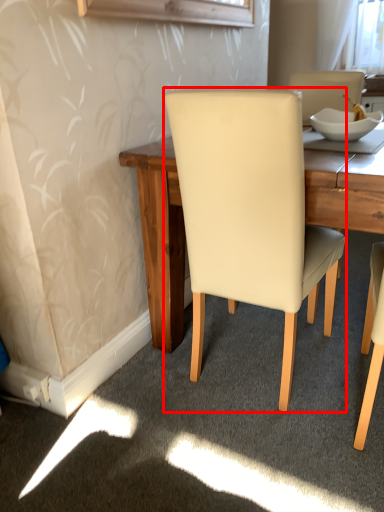
Question: Where is chair (annotated by the red box) located in relation to bowl in the image?

Choices:
 (A) right
 (B) left

Answer: (B)